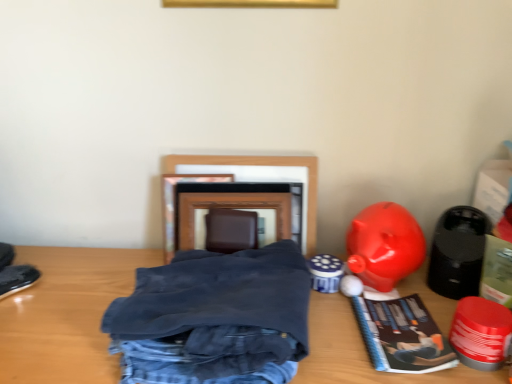
This screenshot has width=512, height=384. In order to click on vacant area that lies to the right of black suede shoe at left in this screenshot , I will do `click(70, 299)`.